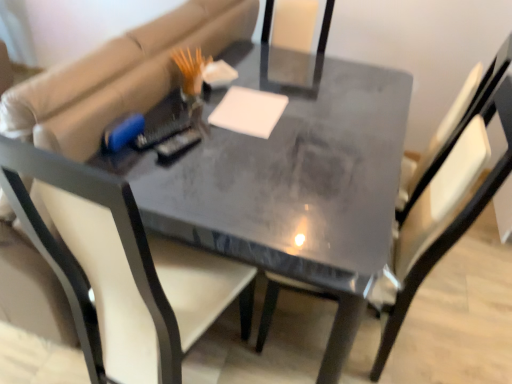
Identify the location of free location to the right of white matte notepad at center. The height and width of the screenshot is (384, 512). (314, 122).